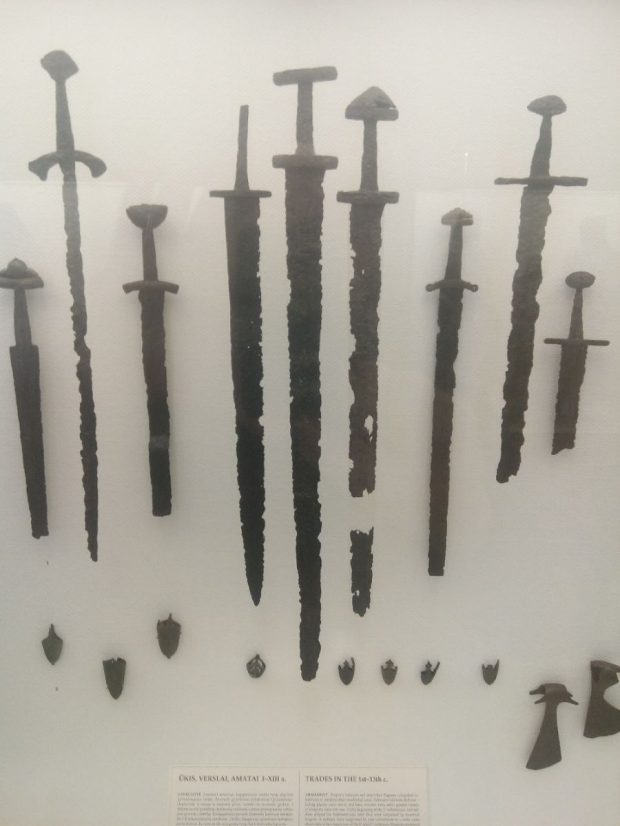
You are a GUI agent. You are given a task and a screenshot of the screen. Output one action in this format:
    pyautogui.click(x=<x>, y=<y>)
    Task: Click on the largest sword hanging on the wall
    This screenshot has height=826, width=620.
    Given the screenshot: What is the action you would take?
    pyautogui.click(x=301, y=411)